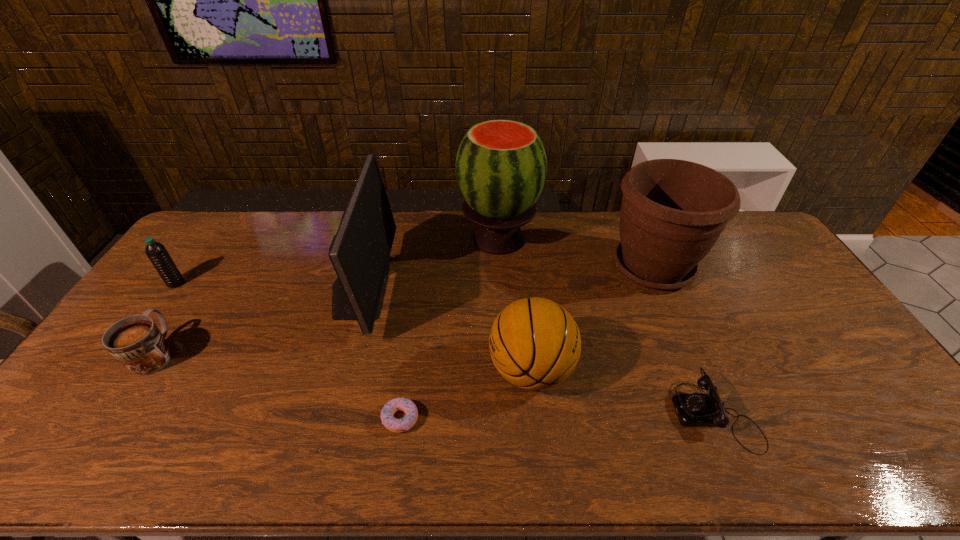
Where is `doughnut`? This screenshot has width=960, height=540. doughnut is located at coordinates (388, 420).

Locate an element on the screen. This screenshot has height=540, width=960. vacant space located on the left of the tallest object is located at coordinates (387, 239).

Locate an element on the screen. The width and height of the screenshot is (960, 540). vacant space situated 0.160m on the screen side of the sixth object from right to left is located at coordinates (438, 286).

Identify the location of free space located 0.090m on the left of the flowerpot. (578, 267).

The height and width of the screenshot is (540, 960). I want to click on vacant space located 0.050m on the surface of the basketball near the brand logo, so click(469, 370).

Locate an element on the screen. vacant area located 0.340m on the surface of the basketball near the brand logo is located at coordinates (363, 370).

Where is `vacant space situated on the surface of the basketball near the brand logo`? The image size is (960, 540). vacant space situated on the surface of the basketball near the brand logo is located at coordinates (447, 370).

You are a GUI agent. You are given a task and a screenshot of the screen. Output one action in this format:
    pyautogui.click(x=<x>, y=<y>)
    Task: Click on the free point located on the front of the leftmost object
    The height and width of the screenshot is (540, 960).
    Given the screenshot: What is the action you would take?
    pyautogui.click(x=109, y=375)

The height and width of the screenshot is (540, 960). I want to click on free space located on the side of the sixth tallest object with the handle, so click(x=201, y=288).

Where is `vacant area situated 0.230m on the side of the sixth tallest object with the handle`? Image resolution: width=960 pixels, height=540 pixels. vacant area situated 0.230m on the side of the sixth tallest object with the handle is located at coordinates (207, 278).